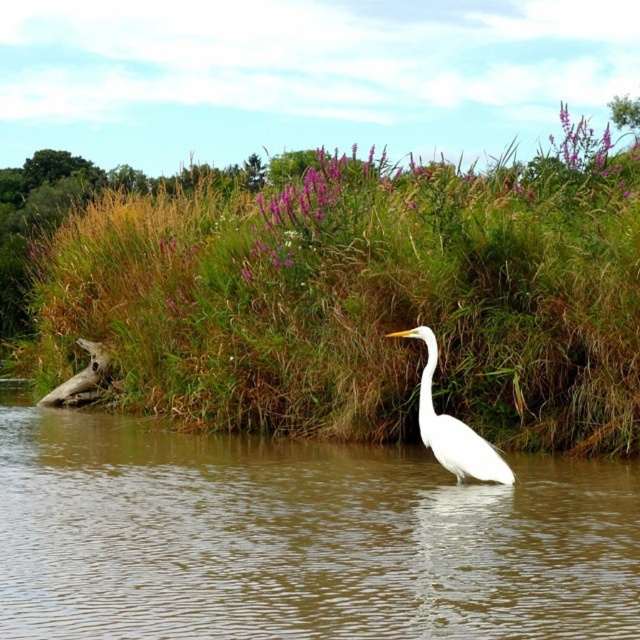
You are a photographer aiming to capture the white smooth heron at center in your shot. The brown muddy water at center is part of the background. Since the water is wider than the heron, how should you adjust your camera framing to ensure the heron is the main focus?

The brown muddy water at center is wider than the white smooth heron at center. To make the heron the main focus, adjust the camera framing to zoom in slightly on the white smooth heron at center, ensuring its narrower width is emphasized against the broader water backdrop.

You are a photographer trying to capture the white heron in the scene. You notice the green grass at center and the brown muddy water at center. Which object is closer to your camera lens?

The green grass at center is closer to the camera lens because it is further to the viewer than the brown muddy water at center.